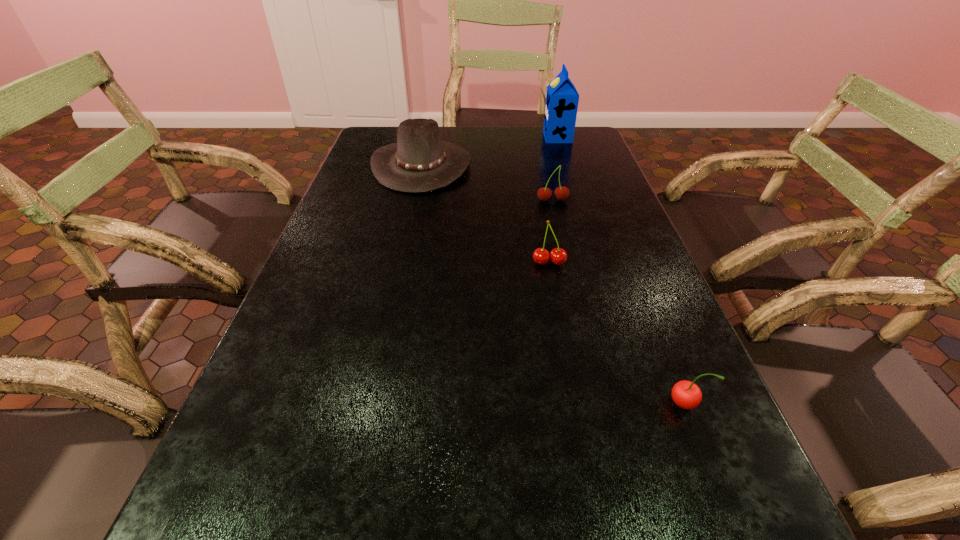
Image resolution: width=960 pixels, height=540 pixels. Identify the location of vacant position in the image that satisfies the following two spatial constraints: 1. on the surface of the nearest cherry; 2. on the right side of the farthest cherry. (600, 403).